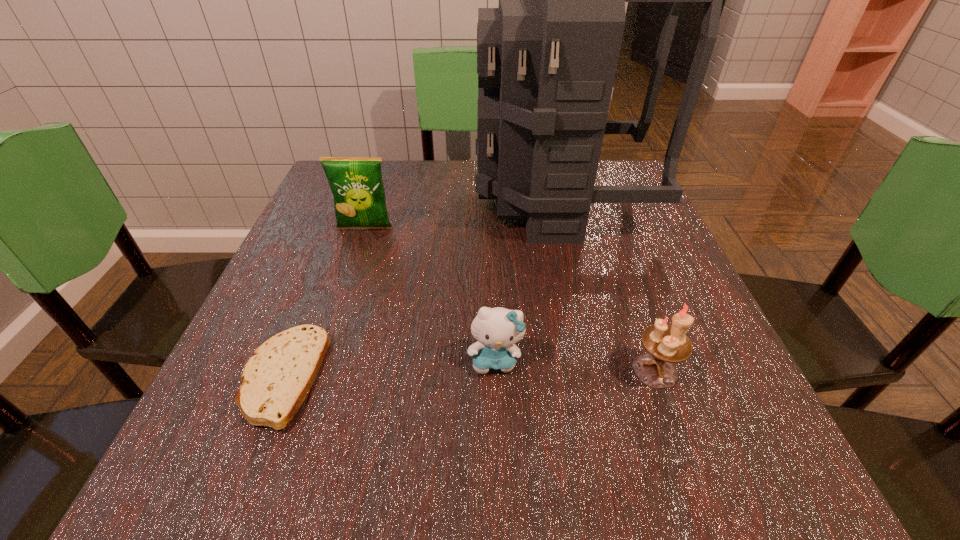
What are the coordinates of `vacant space that satisfies the following two spatial constraints: 1. on the front-facing side of the candle holder; 2. on the right side of the crisp (potato chip)` in the screenshot? It's located at (318, 370).

The image size is (960, 540). I want to click on vacant area in the image that satisfies the following two spatial constraints: 1. on the front compartment of the third shortest object; 2. on the left side of the backpack, so click(602, 370).